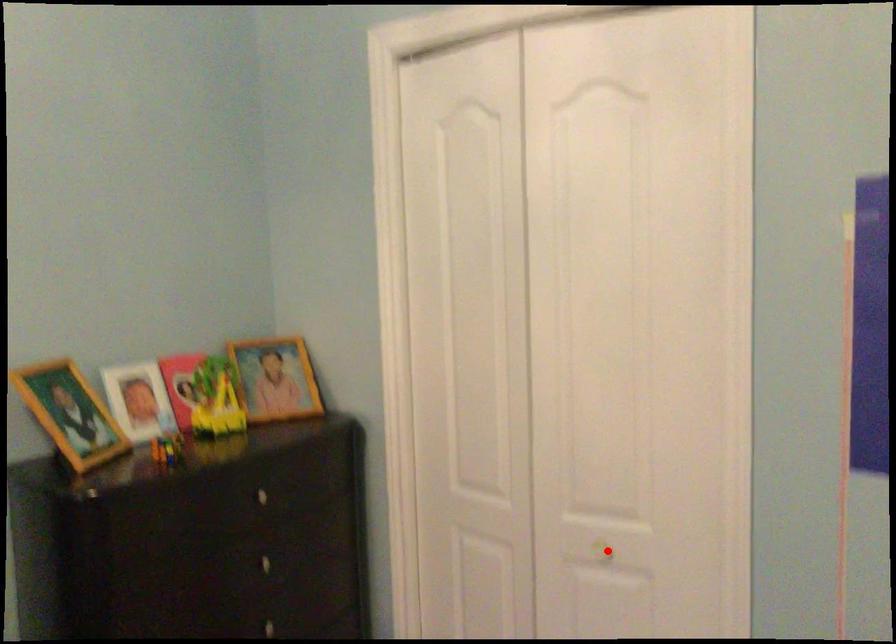
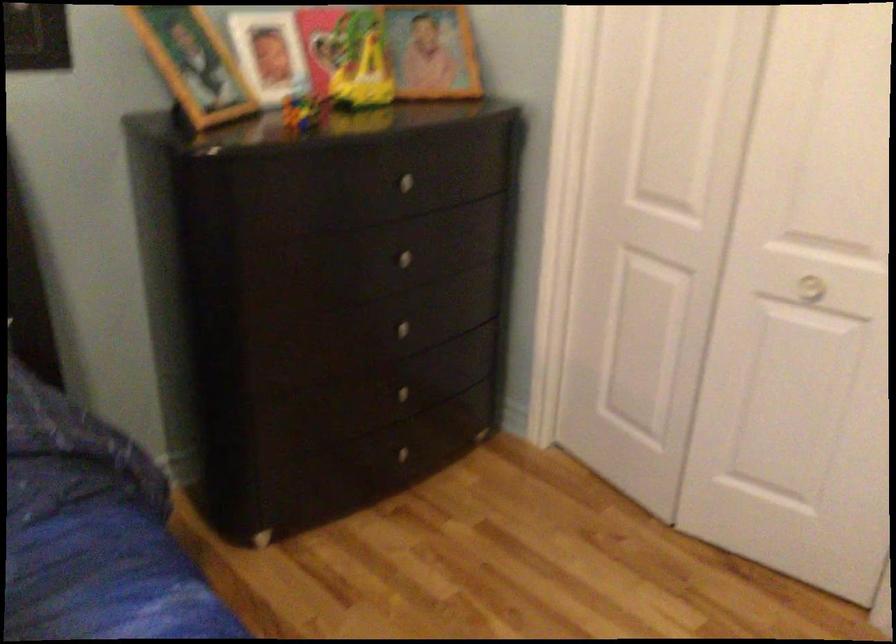
Locate, in the second image, the point that corresponds to the highlighted location in the first image.

(810, 288)